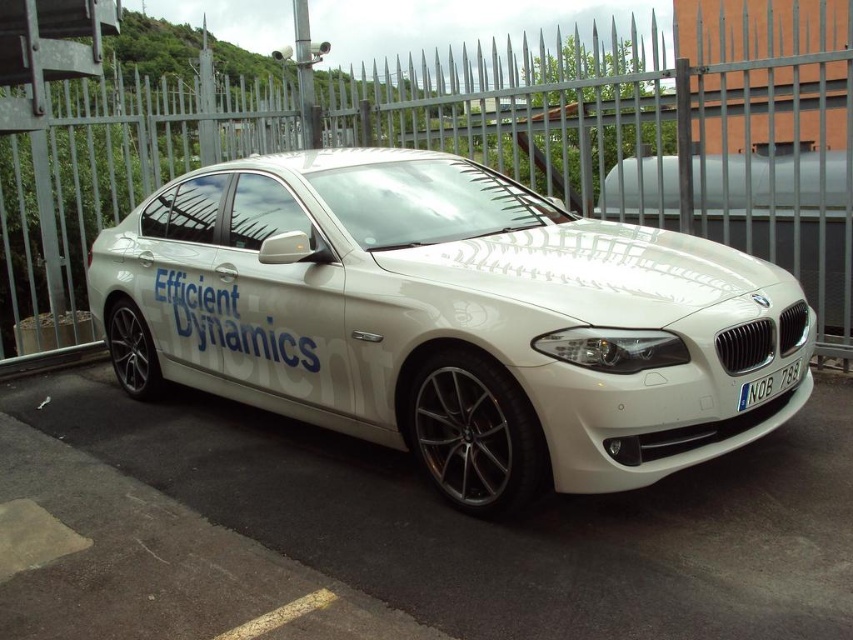
Is white glossy car at center to the right of blue metallic license plate at front from the viewer's perspective?

In fact, white glossy car at center is to the left of blue metallic license plate at front.

The image size is (853, 640). What do you see at coordinates (448, 320) in the screenshot?
I see `white glossy car at center` at bounding box center [448, 320].

The height and width of the screenshot is (640, 853). Describe the element at coordinates (448, 320) in the screenshot. I see `white glossy car at center` at that location.

The height and width of the screenshot is (640, 853). What are the coordinates of `white glossy car at center` in the screenshot? It's located at click(x=448, y=320).

Can you confirm if metallic silver fence at center is wider than blue metallic license plate at front?

Incorrect, metallic silver fence at center's width does not surpass blue metallic license plate at front's.

Between metallic silver fence at center and blue metallic license plate at front, which one has less height?

With less height is blue metallic license plate at front.

Who is more distant from viewer, (171, 177) or (764, 381)?

The point (171, 177) is behind.

I want to click on metallic silver fence at center, so click(474, 145).

This screenshot has width=853, height=640. I want to click on white glossy car at center, so click(x=448, y=320).